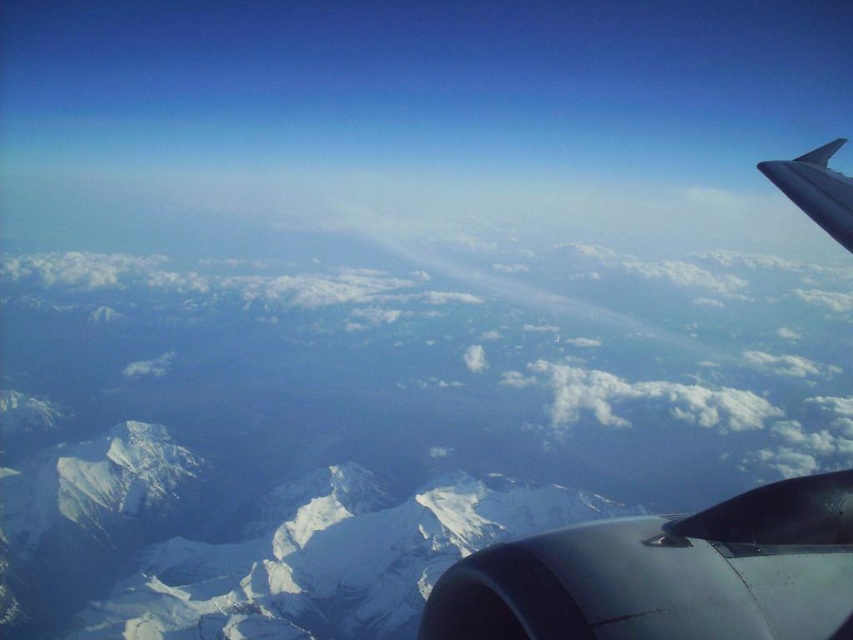
Question: Can you confirm if metallic gray engine at right is positioned to the right of silver metallic wing at upper right?

Choices:
 (A) yes
 (B) no

Answer: (B)

Question: Does metallic gray engine at right appear on the right side of silver metallic wing at upper right?

Choices:
 (A) no
 (B) yes

Answer: (A)

Question: Which is nearer to the metallic gray engine at right?

Choices:
 (A) silver metallic wing at upper right
 (B) white snow-covered mountain range at center

Answer: (A)

Question: Estimate the real-world distances between objects in this image. Which object is closer to the white snow-covered mountain range at center?

Choices:
 (A) metallic gray engine at right
 (B) silver metallic wing at upper right
 (C) metallic gray engine at lower right

Answer: (B)

Question: Does white snow-covered mountain range at center have a lesser width compared to silver metallic wing at upper right?

Choices:
 (A) no
 (B) yes

Answer: (A)

Question: Which object is positioned farthest from the silver metallic wing at upper right?

Choices:
 (A) metallic gray engine at lower right
 (B) metallic gray engine at right
 (C) white snow-covered mountain range at center

Answer: (C)